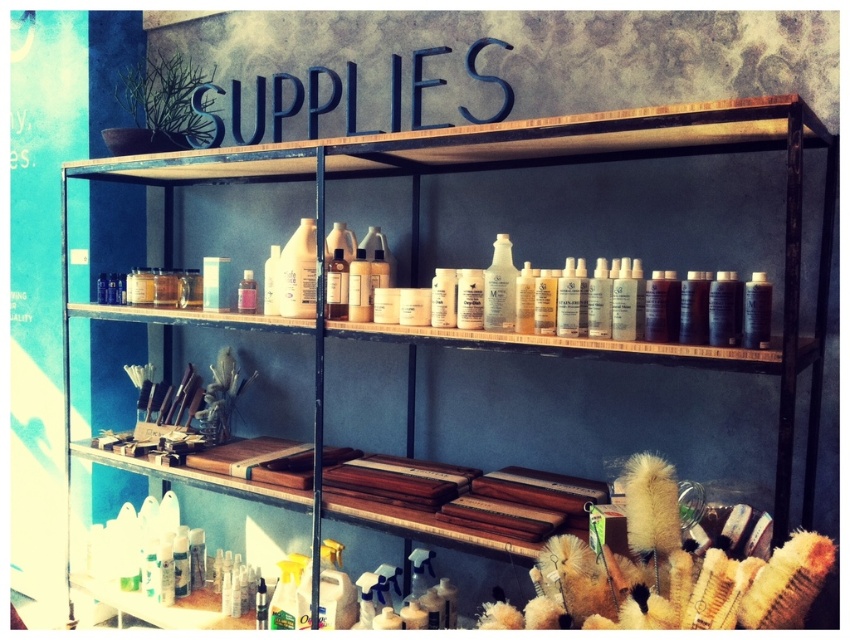
You are an assistant organizing the workshop. You need to reach the translucent plastic bottle at center and the pink matte jar at center from your current position. Which one will you have to move first to access the other?

You will have to move the translucent plastic bottle at center first because it is closer to you than the pink matte jar at center, so you need to move it to reach the jar behind it.